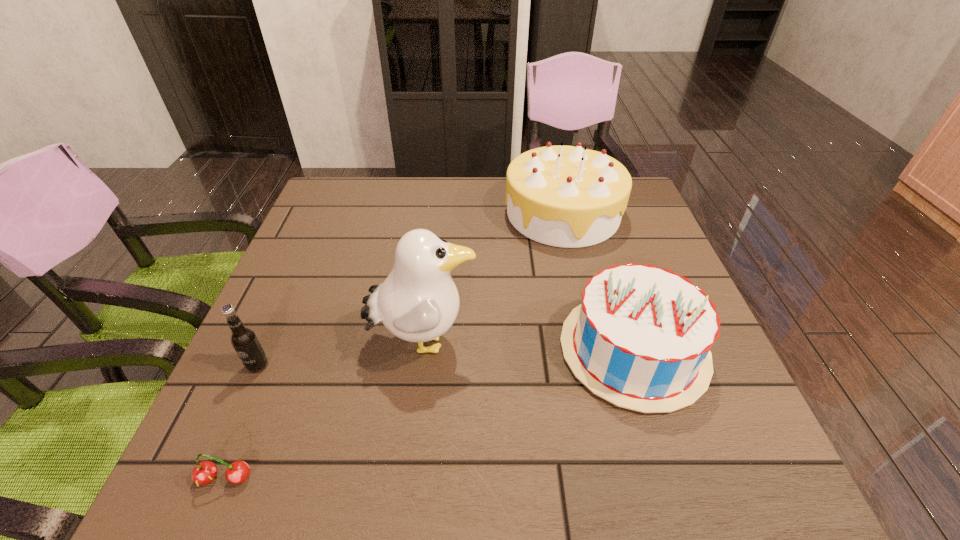
Locate an element on the screen. The image size is (960, 540). free point at the far left corner is located at coordinates (372, 189).

You are a GUI agent. You are given a task and a screenshot of the screen. Output one action in this format:
    pyautogui.click(x=<x>, y=<y>)
    Task: Click on the free space at the far right corner of the desktop
    The height and width of the screenshot is (540, 960).
    Given the screenshot: What is the action you would take?
    pyautogui.click(x=634, y=199)

You are a GUI agent. You are given a task and a screenshot of the screen. Output one action in this format:
    pyautogui.click(x=<x>, y=<y>)
    Task: Click on the vacant area at the near right corner
    Image resolution: width=960 pixels, height=540 pixels.
    Given the screenshot: What is the action you would take?
    pyautogui.click(x=762, y=492)

The image size is (960, 540). I want to click on free space between the root beer and the nearest object, so click(242, 422).

Where is `free spot between the nearest object and the farthest object`? This screenshot has width=960, height=540. free spot between the nearest object and the farthest object is located at coordinates (394, 346).

The height and width of the screenshot is (540, 960). What are the coordinates of `empty space that is in between the farthest object and the third object from left to right` in the screenshot? It's located at (493, 278).

Where is `free space between the tallest object and the shorter birthday cake`? free space between the tallest object and the shorter birthday cake is located at coordinates (528, 346).

I want to click on free point between the third object from right to left and the shorter birthday cake, so click(x=528, y=346).

This screenshot has width=960, height=540. I want to click on free spot between the third object from left to right and the root beer, so click(x=341, y=354).

The image size is (960, 540). I want to click on vacant region between the cherry and the farthest object, so click(394, 346).